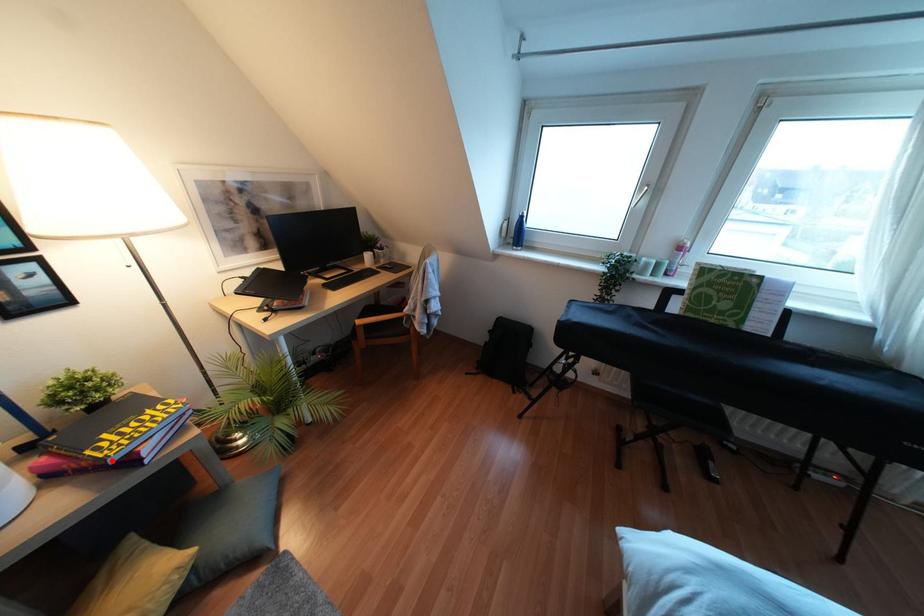
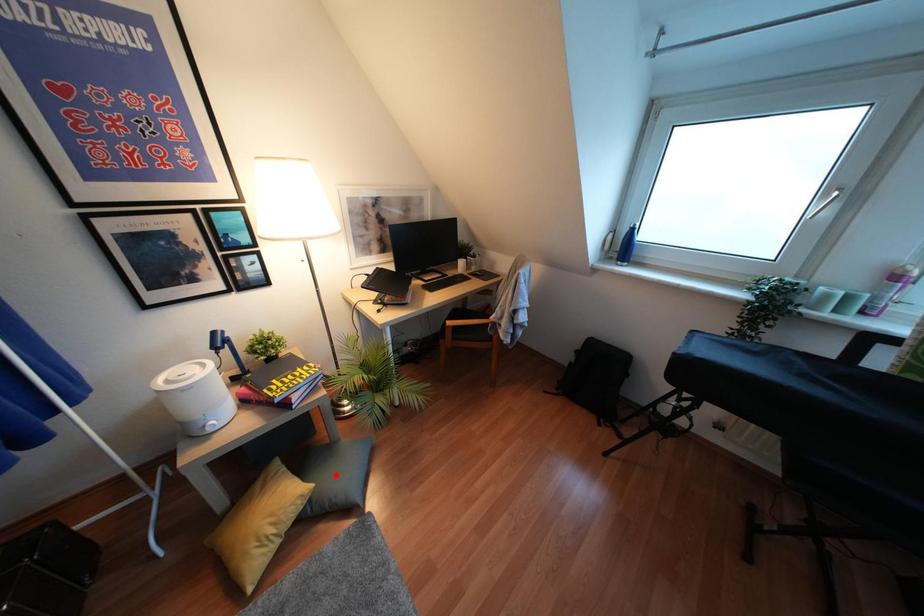
I am providing you with two images of the same scene from different viewpoints. A red point is marked on the first image and another point is marked on the second image. Does the point marked in image1 correspond to the same location as the one in image2?

No